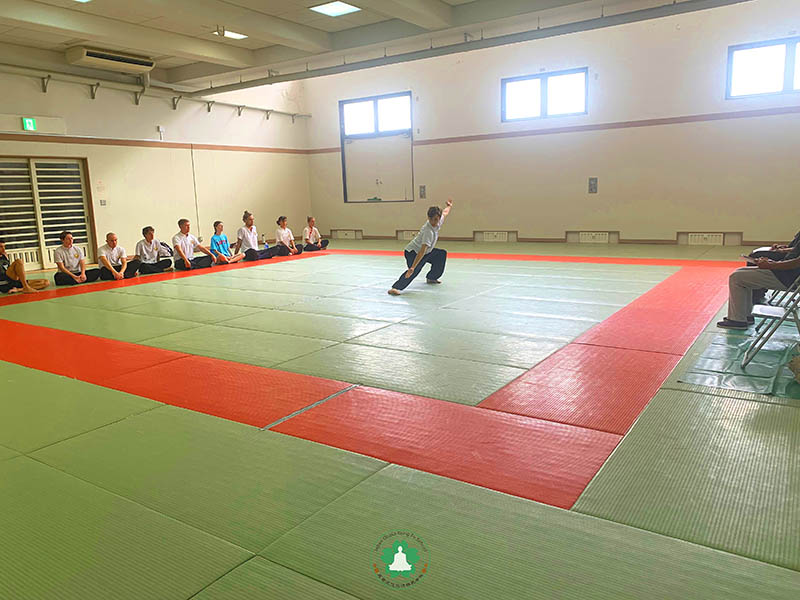
The height and width of the screenshot is (600, 800). Find the location of `air conditioning unit`. air conditioning unit is located at coordinates (130, 59).